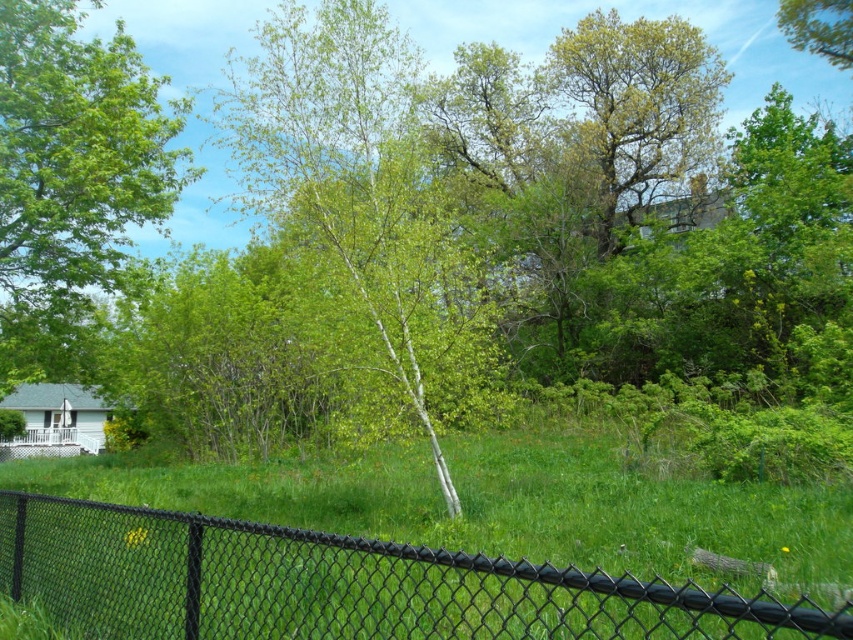
Does black chain-link fence at lower left come behind white smooth tree at center?

No, it is not.

Which is more to the left, black chain-link fence at lower left or white smooth tree at center?

white smooth tree at center

Does point (45, 566) lie in front of point (479, 364)?

Yes, it is.

Locate an element on the screen. black chain-link fence at lower left is located at coordinates (338, 584).

From the picture: Can you confirm if white smooth tree at center is positioned to the right of green leafy tree at left?

Correct, you'll find white smooth tree at center to the right of green leafy tree at left.

Can you confirm if white smooth tree at center is taller than green leafy tree at left?

Correct, white smooth tree at center is much taller as green leafy tree at left.

Where is `white smooth tree at center`? white smooth tree at center is located at coordinates (360, 186).

Is black chain-link fence at lower left wider than green leafy tree at left?

Incorrect, black chain-link fence at lower left's width does not surpass green leafy tree at left's.

Who is higher up, black chain-link fence at lower left or green leafy tree at left?

green leafy tree at left is higher up.

Which is behind, point (625, 618) or point (131, 80)?

The point (131, 80) is behind.

Locate an element on the screen. black chain-link fence at lower left is located at coordinates (338, 584).